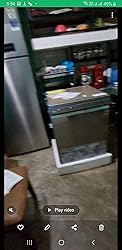
This screenshot has height=250, width=122. In order to click on chair in this screenshot , I will do `click(19, 188)`.